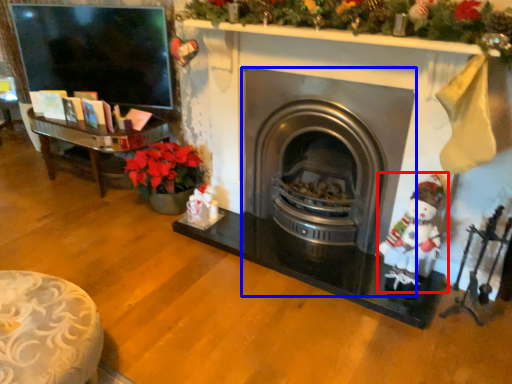
Question: Among these objects, which one is nearest to the camera, santa claus (highlighted by a red box) or wood burning stove (highlighted by a blue box)?

Choices:
 (A) santa claus
 (B) wood burning stove

Answer: (A)